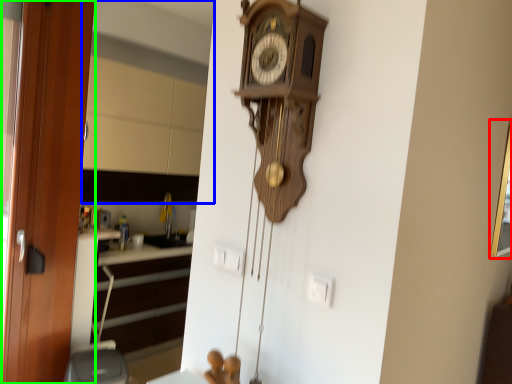
Question: Estimate the real-world distances between objects in this image. Which object is farther from picture frame (highlighted by a red box), mirror (highlighted by a blue box) or door (highlighted by a green box)?

Choices:
 (A) mirror
 (B) door

Answer: (A)